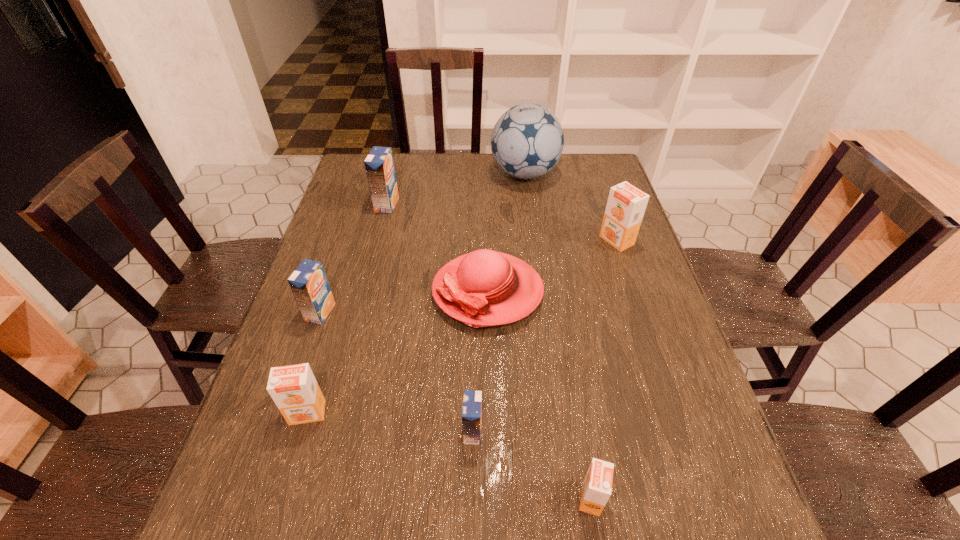
This screenshot has height=540, width=960. I want to click on red hat, so click(x=484, y=288).

Locate an element on the screen. Image resolution: width=960 pixels, height=540 pixels. the nearest blue orange_juice is located at coordinates (472, 399).

Locate an element on the screen. The image size is (960, 540). the third orange juice from right to left is located at coordinates (472, 399).

What are the coordinates of `the nearest object` in the screenshot? It's located at (596, 490).

Locate an element on the screen. This screenshot has width=960, height=540. the second orange orange juice from right to left is located at coordinates (596, 490).

Find the location of `vacant region located 0.290m on the side with brand of the blue soccer ball`. vacant region located 0.290m on the side with brand of the blue soccer ball is located at coordinates (407, 174).

You are a GUI agent. You are given a task and a screenshot of the screen. Output one action in this format:
    pyautogui.click(x=<x>, y=<y>)
    Task: Click on the vacant area located 0.220m on the side with brand of the blue soccer ball
    This screenshot has width=960, height=540.
    Given the screenshot: What is the action you would take?
    pos(427,174)

The height and width of the screenshot is (540, 960). What are the coordinates of `blank space located 0.090m on the side with brand of the blue soccer ball` in the screenshot? It's located at (465, 174).

This screenshot has width=960, height=540. In order to click on free space located 0.400m on the front of the biggest blue orange_juice in this screenshot , I will do `click(360, 311)`.

Locate an element on the screen. This screenshot has width=960, height=540. free spot located on the left of the biggest orange orange juice is located at coordinates (542, 240).